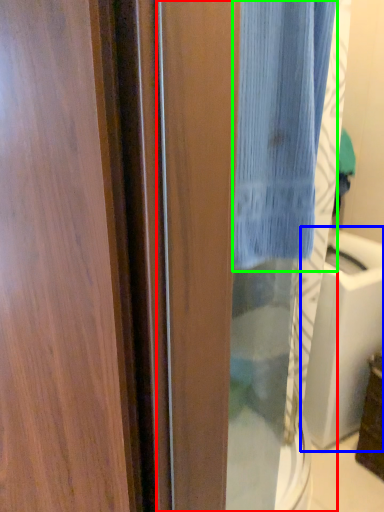
Question: Which object is the farthest from screen door (highlighted by a red box)? Choose among these: sink (highlighted by a blue box) or curtain (highlighted by a green box).

Choices:
 (A) sink
 (B) curtain

Answer: (B)